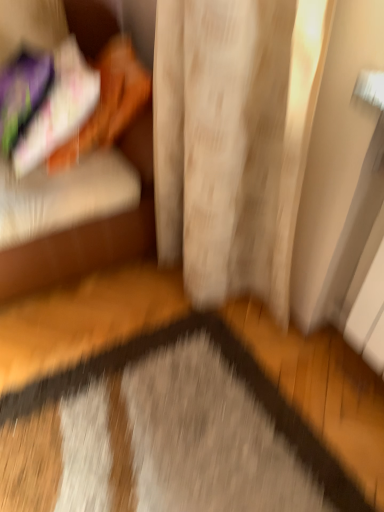
Where is `velvet orange couch at left`? Image resolution: width=384 pixels, height=512 pixels. velvet orange couch at left is located at coordinates (76, 252).

What do you see at coordinates (76, 252) in the screenshot? This screenshot has width=384, height=512. I see `velvet orange couch at left` at bounding box center [76, 252].

What is the approximate width of velvet orange couch at left?

velvet orange couch at left is 25.44 inches wide.

Image resolution: width=384 pixels, height=512 pixels. I want to click on gray textured mat at center, so click(x=165, y=434).

The height and width of the screenshot is (512, 384). What do you see at coordinates (165, 434) in the screenshot? I see `gray textured mat at center` at bounding box center [165, 434].

Where is `velvet orange couch at left`? velvet orange couch at left is located at coordinates (76, 252).

In the image, is velvet orange couch at left on the left side or the right side of gray textured mat at center?

Clearly, velvet orange couch at left is on the left of gray textured mat at center in the image.

Does velvet orange couch at left come in front of gray textured mat at center?

No, velvet orange couch at left is further to the viewer.

Is point (153, 220) positioned before point (116, 424)?

No.

From the image's perspective, is velvet orange couch at left over gray textured mat at center?

Yes, from the image's perspective, velvet orange couch at left is above gray textured mat at center.

From a real-world perspective, is velvet orange couch at left on gray textured mat at center?

Yes, from a real-world perspective, velvet orange couch at left is above gray textured mat at center.

Considering the sizes of objects velvet orange couch at left and gray textured mat at center in the image provided, who is wider, velvet orange couch at left or gray textured mat at center?

Wider between the two is gray textured mat at center.

Is velvet orange couch at left taller or shorter than gray textured mat at center?

Clearly, velvet orange couch at left is taller compared to gray textured mat at center.

Based on the photo, does velvet orange couch at left have a larger size compared to gray textured mat at center?

Yes, velvet orange couch at left is bigger than gray textured mat at center.

Would you say velvet orange couch at left is inside or outside gray textured mat at center?

velvet orange couch at left exists outside the volume of gray textured mat at center.

Would you say velvet orange couch at left is a long distance from gray textured mat at center?

No, velvet orange couch at left is not far from gray textured mat at center.

Does velvet orange couch at left turn towards gray textured mat at center?

Yes, velvet orange couch at left is turned towards gray textured mat at center.

From the picture: Can you tell me how much velvet orange couch at left and gray textured mat at center differ in facing direction?

velvet orange couch at left and gray textured mat at center are facing 175 degrees away from each other.

Measure the distance from velvet orange couch at left to gray textured mat at center.

velvet orange couch at left is 63.61 centimeters away from gray textured mat at center.

The image size is (384, 512). Identify the location of furniture on the left of gray textured mat at center. (76, 252).

Visually, is gray textured mat at center positioned to the left or to the right of velvet orange couch at left?

gray textured mat at center is to the right of velvet orange couch at left.

Based on the photo, which is in front, gray textured mat at center or velvet orange couch at left?

gray textured mat at center is closer to the camera.

Which is in front, point (147, 456) or point (11, 282)?

The point (147, 456) is in front.

From the image's perspective, would you say gray textured mat at center is shown under velvet orange couch at left?

Yes, from the image's perspective, gray textured mat at center is beneath velvet orange couch at left.

From a real-world perspective, is gray textured mat at center positioned above or below velvet orange couch at left?

Clearly, from a real-world perspective, gray textured mat at center is below velvet orange couch at left.

In terms of width, does gray textured mat at center look wider or thinner when compared to velvet orange couch at left?

gray textured mat at center is wider than velvet orange couch at left.

Considering the sizes of gray textured mat at center and velvet orange couch at left in the image, is gray textured mat at center taller or shorter than velvet orange couch at left?

gray textured mat at center is shorter than velvet orange couch at left.

Which of these two, gray textured mat at center or velvet orange couch at left, is smaller?

Smaller between the two is gray textured mat at center.

Would you say velvet orange couch at left is part of gray textured mat at center's contents?

No, velvet orange couch at left is located outside of gray textured mat at center.

Is gray textured mat at center not near velvet orange couch at left?

Actually, gray textured mat at center and velvet orange couch at left are a little close together.

Consider the image. Is gray textured mat at center looking in the opposite direction of velvet orange couch at left?

gray textured mat at center does not have its back to velvet orange couch at left.

Locate an element on the screen. Image resolution: width=384 pixels, height=512 pixels. doormat below the velvet orange couch at left (from a real-world perspective) is located at coordinates (165, 434).

Image resolution: width=384 pixels, height=512 pixels. What are the coordinates of `doormat located on the right of velvet orange couch at left` in the screenshot? It's located at (165, 434).

Identify the location of furniture behind the gray textured mat at center. This screenshot has height=512, width=384. (76, 252).